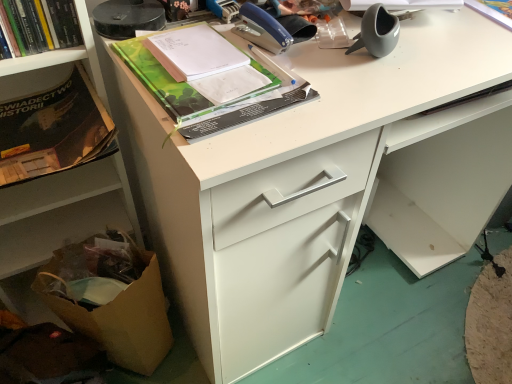
Locate an element on the screen. free space that is to the left of matte gray vase at upper right, which is the 2th office supplies in left-to-right order is located at coordinates (313, 50).